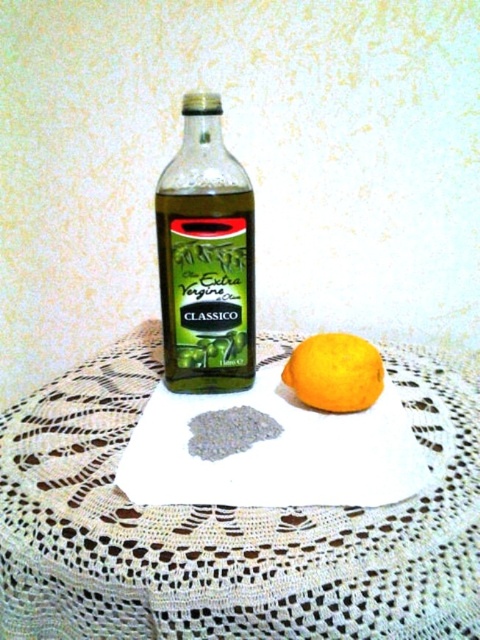
Question: Which of the following is the farthest from the observer?

Choices:
 (A) (304, 372)
 (B) (182, 172)

Answer: (B)

Question: Can you confirm if green glass bottle at center is positioned to the left of orange matte at center?

Choices:
 (A) yes
 (B) no

Answer: (A)

Question: Does white lace doily at center appear over orange matte at center?

Choices:
 (A) yes
 (B) no

Answer: (B)

Question: Considering the real-world distances, which object is farthest from the white lace doily at center?

Choices:
 (A) orange matte at center
 (B) green glass bottle at center

Answer: (B)

Question: Which object is positioned farthest from the white lace doily at center?

Choices:
 (A) orange matte at center
 (B) green glass bottle at center

Answer: (B)

Question: Does white lace doily at center appear over orange matte at center?

Choices:
 (A) no
 (B) yes

Answer: (A)